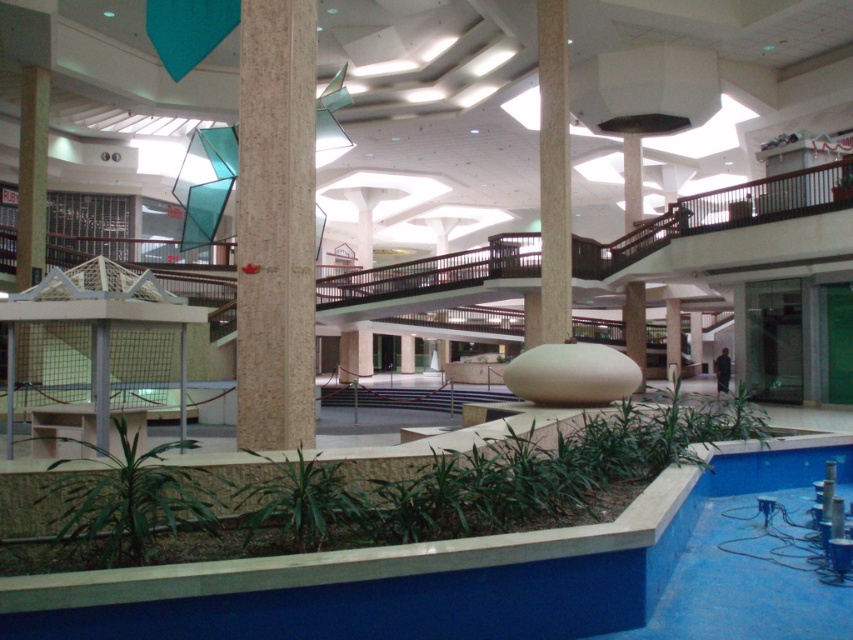
Which is behind, point (432, 586) or point (550, 150)?

The point (550, 150) is more distant.

Describe the element at coordinates (425, 572) in the screenshot. I see `blue smooth pool at lower center` at that location.

Which is in front, point (99, 593) or point (540, 204)?

Point (99, 593) is more forward.

In order to click on blue smooth pool at lower center in this screenshot , I will do `click(425, 572)`.

Is green leafy plant at lower left shorter than beige marble pillar at center?

In fact, green leafy plant at lower left may be taller than beige marble pillar at center.

Between green leafy plant at lower left and beige marble pillar at center, which one has more height?

Standing taller between the two is green leafy plant at lower left.

Which is behind, point (134, 451) or point (553, 104)?

Point (553, 104)

You are a GUI agent. You are given a task and a screenshot of the screen. Output one action in this format:
    pyautogui.click(x=<x>, y=<y>)
    Task: Click on the green leafy plant at lower left
    This screenshot has width=853, height=640.
    Given the screenshot: What is the action you would take?
    pyautogui.click(x=129, y=500)

Between blue smooth pool at lower center and green leafy plant at lower center, which one is positioned lower?

blue smooth pool at lower center is below.

Measure the distance between blue smooth pool at lower center and green leafy plant at lower center.

blue smooth pool at lower center is 75.88 centimeters from green leafy plant at lower center.

Who is more forward, (424, 609) or (264, 522)?

Point (424, 609) is more forward.

I want to click on blue smooth pool at lower center, so click(x=425, y=572).